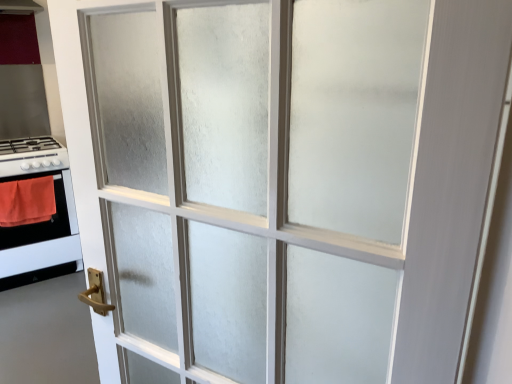
Question: Is wooden handle at lower left situated inside orange fabric at left or outside?

Choices:
 (A) outside
 (B) inside

Answer: (A)

Question: In terms of width, does wooden handle at lower left look wider or thinner when compared to orange fabric at left?

Choices:
 (A) thin
 (B) wide

Answer: (B)

Question: Based on their relative distances, which object is farther from the orange fabric at left?

Choices:
 (A) white glossy gas stove at left
 (B) wooden handle at lower left
 (C) white glossy stove at left

Answer: (B)

Question: Based on their relative distances, which object is nearer to the white glossy gas stove at left?

Choices:
 (A) wooden handle at lower left
 (B) orange fabric at left
 (C) white glossy stove at left

Answer: (B)